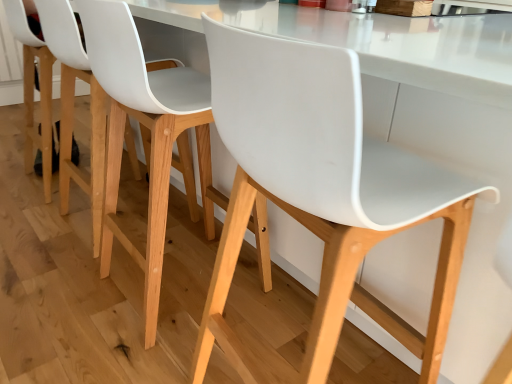
Question: Is white plastic chair at center, acting as the 2th chair starting from the right, spatially inside white matte plastic chair at center, positioned as the 2th chair in left-to-right order, or outside of it?

Choices:
 (A) outside
 (B) inside

Answer: (A)

Question: Considering the positions of white plastic chair at center, acting as the 2th chair starting from the right, and white matte plastic chair at center, positioned as the 2th chair in left-to-right order, in the image, is white plastic chair at center, acting as the 2th chair starting from the right, bigger or smaller than white matte plastic chair at center, positioned as the 2th chair in left-to-right order,?

Choices:
 (A) big
 (B) small

Answer: (A)

Question: From a real-world perspective, is white plastic chair at center, which is counted as the 1th chair, starting from the left, physically located above or below white matte plastic chair at center, which is the 1th chair in right-to-left order?

Choices:
 (A) above
 (B) below

Answer: (B)

Question: Considering the positions of white matte plastic chair at center, which is the 1th chair in right-to-left order, and white plastic chair at center, which is counted as the 1th chair, starting from the left, in the image, is white matte plastic chair at center, which is the 1th chair in right-to-left order, bigger or smaller than white plastic chair at center, which is counted as the 1th chair, starting from the left,?

Choices:
 (A) big
 (B) small

Answer: (B)

Question: From the image's perspective, is white matte plastic chair at center, which is the 1th chair in right-to-left order, above or below white plastic chair at center, which is counted as the 1th chair, starting from the left?

Choices:
 (A) below
 (B) above

Answer: (A)

Question: In the image, is white matte plastic chair at center, positioned as the 2th chair in left-to-right order, positioned in front of or behind white plastic chair at center, acting as the 2th chair starting from the right?

Choices:
 (A) behind
 (B) front

Answer: (B)

Question: Is white matte plastic chair at center, which is the 1th chair in right-to-left order, inside the boundaries of white plastic chair at center, acting as the 2th chair starting from the right, or outside?

Choices:
 (A) outside
 (B) inside

Answer: (A)